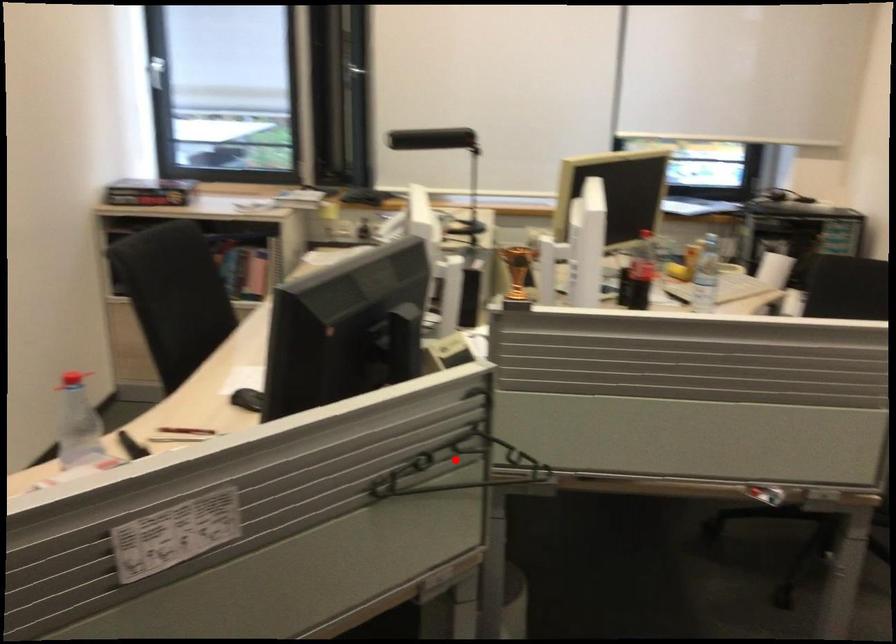
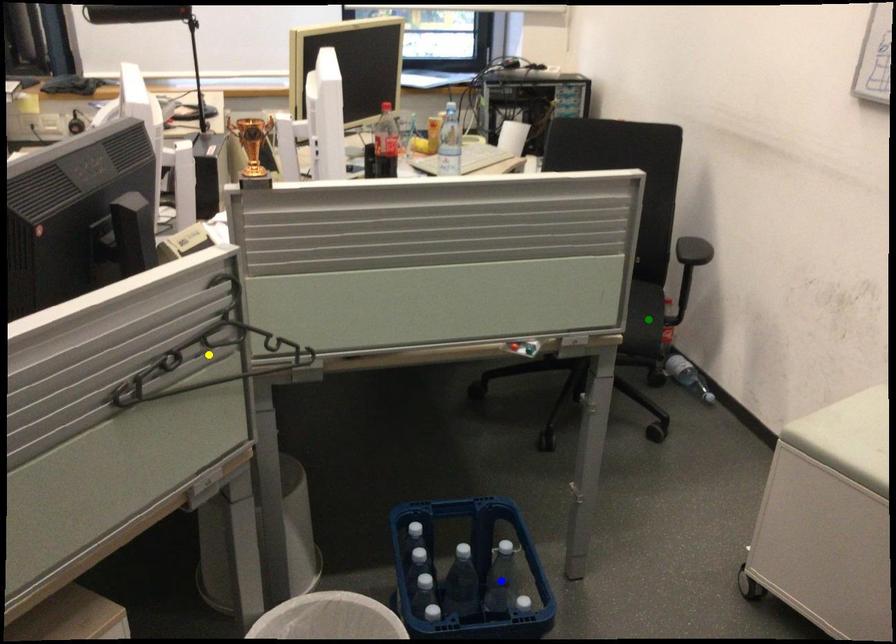
Question: I am providing you with two images of the same scene from different viewpoints. A red point is marked on the first image. You are given multiple points on the second image. Which mark in image 2 goes with the point in image 1?

Choices:
 (A) yellow point
 (B) green point
 (C) blue point

Answer: (A)